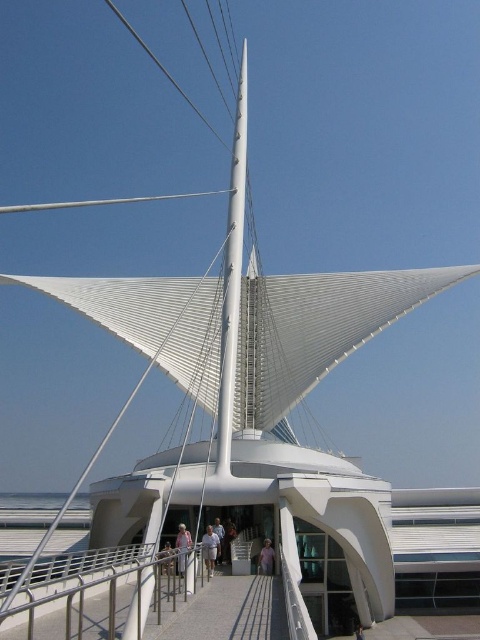
You are a visitor standing on the rounded white platform at the base of the structure. You notice the satin silver railing at lower center and the light brown wooden handrail at center. Which object is taller?

The satin silver railing at lower center is much taller than the light brown wooden handrail at center.

You are a maintenance worker tasked with ensuring safety on the bridge. You have a tool that measures railings and handrails. Which object has a greater width between the satin silver railing at lower center and the light brown wooden handrail at center?

The satin silver railing at lower center has a greater width than the light brown wooden handrail at center according to the description.

You are standing on the gray concrete path at center and want to reach the light skin tone person at center. Can you walk directly to them without stepping off the path?

The gray concrete path at center is shorter than light skin tone person at center, so the path may not extend far enough to reach them directly. You might need to step off the path or find another route.